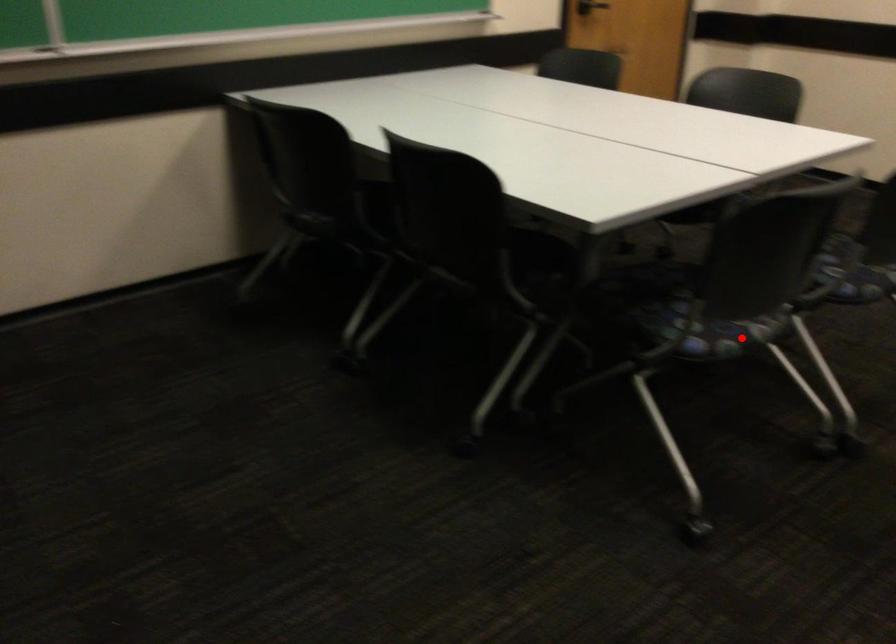
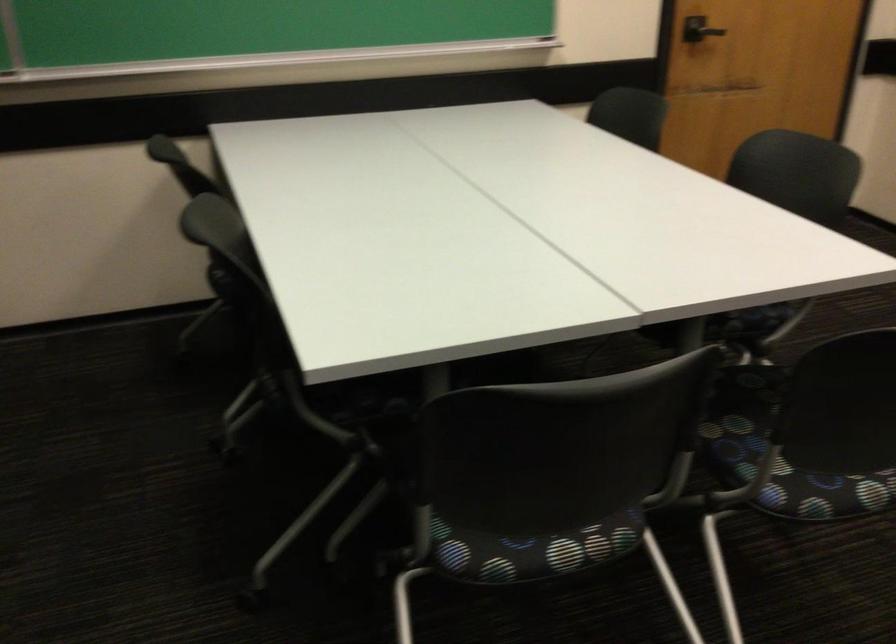
Question: I am providing you with two images of the same scene from different viewpoints. In image1, a red point is highlighted. Considering the same 3D point in image2, which of the following is correct?

Choices:
 (A) It is closer
 (B) It is farther

Answer: (A)